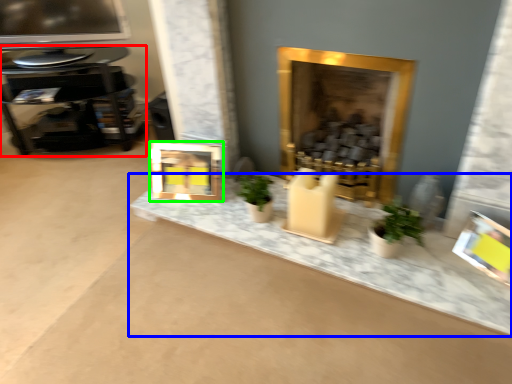
Question: Which object is positioned closest to table (highlighted by a red box)? Select from counter top (highlighted by a blue box) and picture frame (highlighted by a green box).

Choices:
 (A) counter top
 (B) picture frame

Answer: (B)